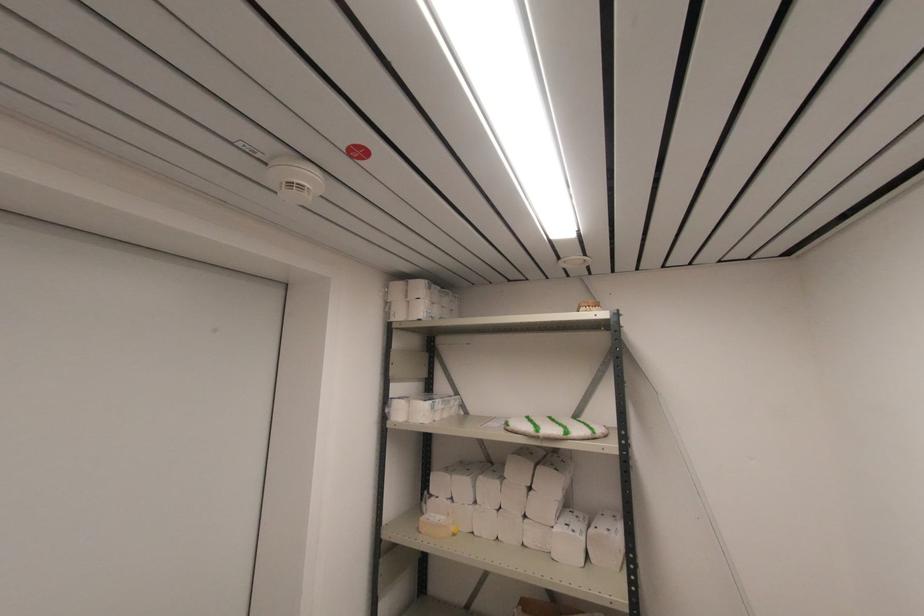
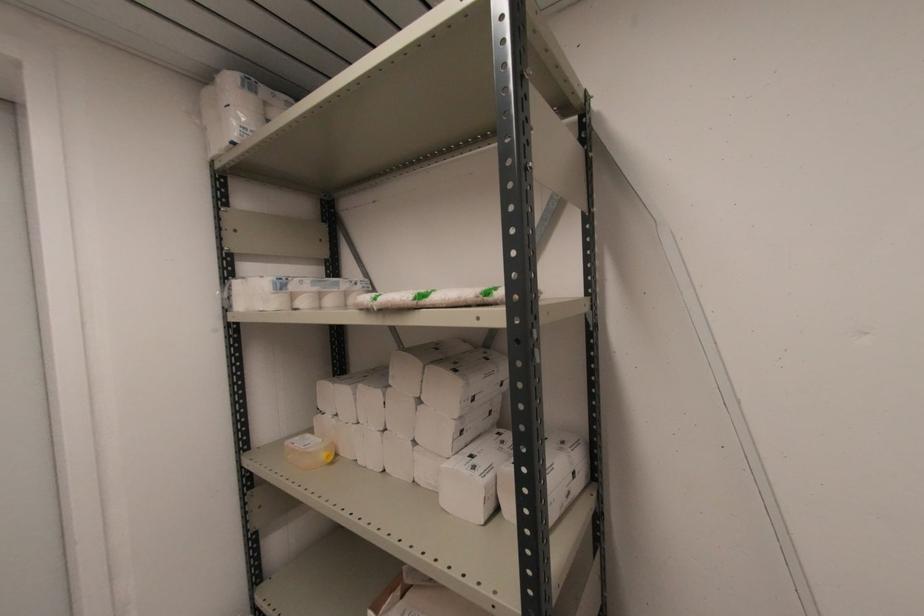
The images are taken continuously from a first-person perspective. In which direction are you moving?

The cameraman moved toward right, forward.